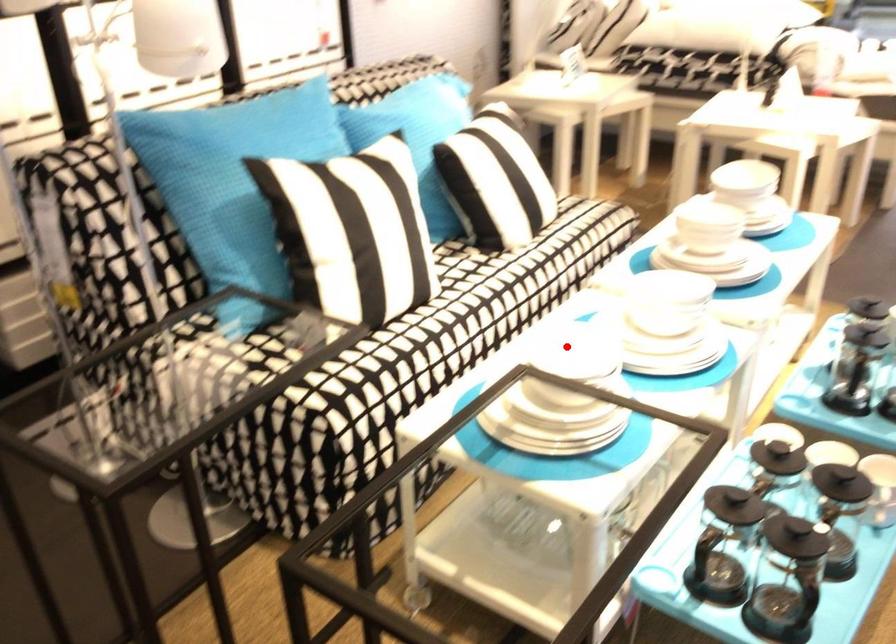
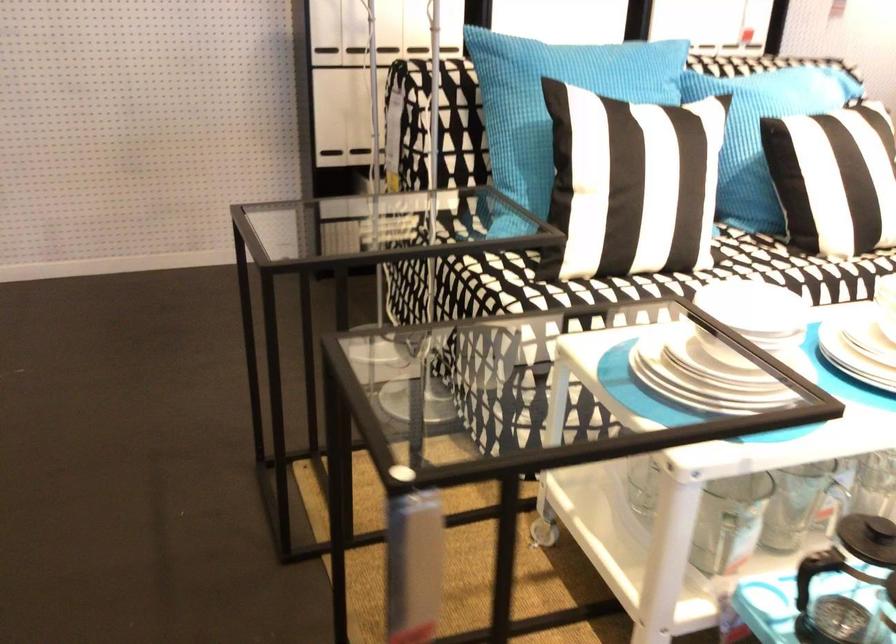
Where in the second image is the point corresponding to the highlighted location from the first image?

(757, 310)